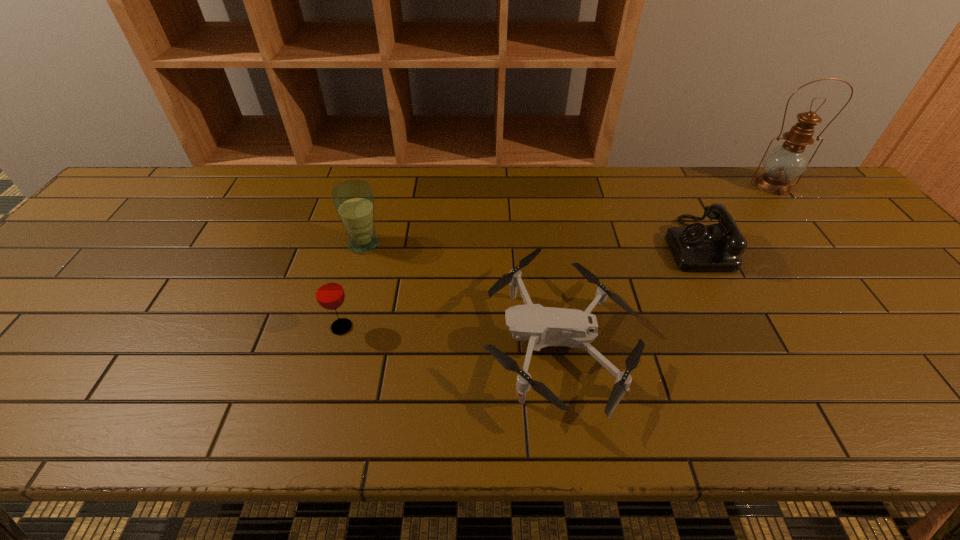
Locate an element on the screen. The width and height of the screenshot is (960, 540). free location located on the right of the nearer glass is located at coordinates (518, 327).

Locate an element on the screen. This screenshot has width=960, height=540. vacant space positioned 0.050m on the dial of the second object from right to left is located at coordinates (648, 244).

Where is `free space located 0.360m on the dial of the second object from right to left`? free space located 0.360m on the dial of the second object from right to left is located at coordinates (534, 244).

Where is `vacant space located 0.340m on the dial of the second object from right to left`? The height and width of the screenshot is (540, 960). vacant space located 0.340m on the dial of the second object from right to left is located at coordinates (541, 244).

At what (x,y) coordinates should I click in order to perform the action: click on free space located with a camera at the front of the shortest object. Please return your answer as a coordinate pair (x, y). Looking at the image, I should click on (382, 342).

You are a GUI agent. You are given a task and a screenshot of the screen. Output one action in this format:
    pyautogui.click(x=<x>, y=<y>)
    Task: Click on the free space located 0.340m with a camera at the front of the shortest object
    Image resolution: width=960 pixels, height=540 pixels.
    Given the screenshot: What is the action you would take?
    tap(327, 342)

At what (x,y) coordinates should I click in order to perform the action: click on free space located 0.120m with a camera at the front of the shortest object. Please return your answer as a coordinate pair (x, y). Looking at the image, I should click on pyautogui.click(x=428, y=342).

I want to click on object at the far edge, so click(x=785, y=162).

Where is `object positioned at the near edge`? object positioned at the near edge is located at coordinates (543, 326).

The height and width of the screenshot is (540, 960). I want to click on object present at the right edge, so click(785, 162).